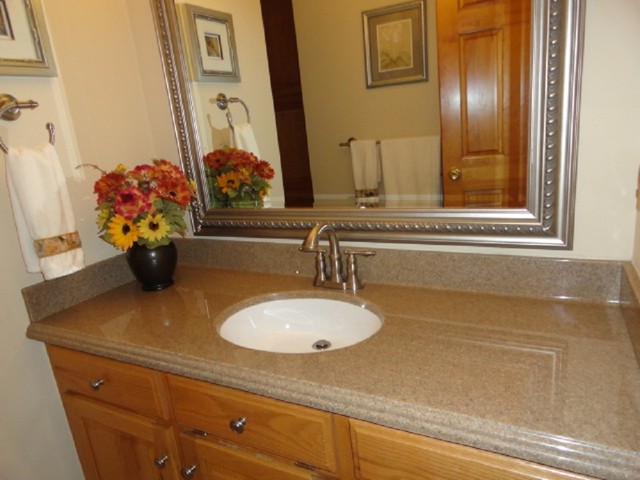
Locate an element on the screen. This screenshot has height=480, width=640. mirror is located at coordinates (273, 23).